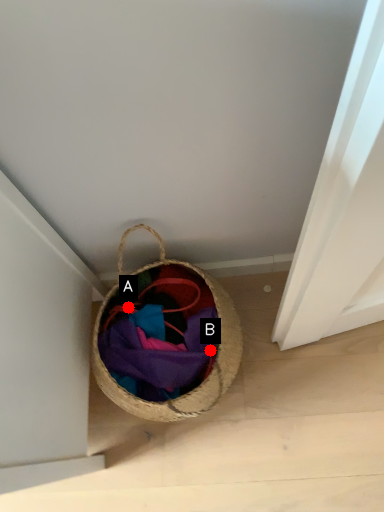
Question: Two points are circled on the image, labeled by A and B beside each circle. Among these points, which one is farthest from the camera?

Choices:
 (A) A is further
 (B) B is further

Answer: (A)